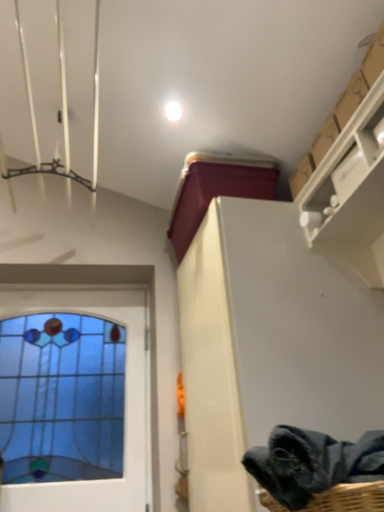
Question: Would you say stained glass window at left is to the left or to the right of white glossy droplight at upper center in the picture?

Choices:
 (A) right
 (B) left

Answer: (B)

Question: In terms of height, does stained glass window at left look taller or shorter compared to white glossy droplight at upper center?

Choices:
 (A) short
 (B) tall

Answer: (B)

Question: Estimate the real-world distances between objects in this image. Which object is farther from the stained glass window at left?

Choices:
 (A) dark gray fabric at lower right
 (B) cardboard at upper right
 (C) white glossy droplight at upper center

Answer: (A)

Question: Considering the real-world distances, which object is farthest from the stained glass window at left?

Choices:
 (A) cardboard at upper right
 (B) dark gray fabric at lower right
 (C) white glossy droplight at upper center

Answer: (B)